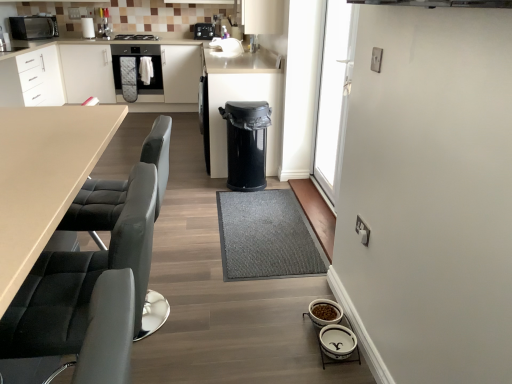
What do you see at coordinates (88, 27) in the screenshot? Image resolution: width=512 pixels, height=384 pixels. I see `white paper towel at upper left, the first appliance in the left-to-right sequence` at bounding box center [88, 27].

From the picture: What is the approximate width of gray textured mat at center?

gray textured mat at center is 23.94 inches wide.

At what (x,y) coordinates should I click in order to perform the action: click on matte black microwave at upper left. Please return your answer as a coordinate pair (x, y). This screenshot has width=512, height=384. Looking at the image, I should click on (33, 27).

What do you see at coordinates (33, 27) in the screenshot? The image size is (512, 384). I see `matte black microwave at upper left` at bounding box center [33, 27].

What is the approximate width of matte white cabinetry at left?

It is 8.17 feet.

This screenshot has height=384, width=512. In order to click on transparent glass door at upper right in this screenshot , I will do click(x=334, y=94).

Measure the distance between transparent glass door at upper right and camera.

transparent glass door at upper right is 2.16 meters from camera.

Identify the location of white paper towel at upper left, the second appliance positioned from the back. (88, 27).

Where is `dish washer that is behind the transparent glass door at upper right`? dish washer that is behind the transparent glass door at upper right is located at coordinates (246, 143).

Between transparent glass door at upper right and black plastic trash can at center, which one has less height?

black plastic trash can at center.

Between point (340, 37) and point (260, 112), which one is positioned behind?

The point (260, 112) is farther.

Between transparent glass door at upper right and black plastic trash can at center, which one appears on the right side from the viewer's perspective?

From the viewer's perspective, transparent glass door at upper right appears more on the right side.

Is black plastic trash can at center spatially inside white paper towel at upper left, the first appliance in the left-to-right sequence, or outside of it?

black plastic trash can at center exists outside the volume of white paper towel at upper left, the first appliance in the left-to-right sequence.

Based on the photo, considering the relative sizes of black plastic trash can at center and white paper towel at upper left, arranged as the second appliance when viewed from the top, in the image provided, is black plastic trash can at center thinner than white paper towel at upper left, arranged as the second appliance when viewed from the top,?

No, black plastic trash can at center is not thinner than white paper towel at upper left, arranged as the second appliance when viewed from the top.

Considering the sizes of black plastic trash can at center and white paper towel at upper left, the second appliance positioned from the back, in the image, is black plastic trash can at center bigger or smaller than white paper towel at upper left, the second appliance positioned from the back,?

Considering their sizes, black plastic trash can at center takes up more space than white paper towel at upper left, the second appliance positioned from the back.

Is the surface of black plastic trash can at center in direct contact with white paper towel at upper left, the second appliance positioned from the back?

No, black plastic trash can at center is not beside white paper towel at upper left, the second appliance positioned from the back.

Is black plastic toaster at upper center, the 3th appliance when ordered from front to back, located outside matte black microwave at upper left?

Yes, black plastic toaster at upper center, the 3th appliance when ordered from front to back, is located beyond the bounds of matte black microwave at upper left.

In the image, is black plastic toaster at upper center, the 1th appliance positioned from the top, on the left side or the right side of matte black microwave at upper left?

black plastic toaster at upper center, the 1th appliance positioned from the top, is to the right of matte black microwave at upper left.

From the image's perspective, between black plastic toaster at upper center, the 2th appliance in the right-to-left sequence, and matte black microwave at upper left, which one is located above?

black plastic toaster at upper center, the 2th appliance in the right-to-left sequence.

Who is smaller, black plastic toaster at upper center, the first appliance positioned from the back, or matte black microwave at upper left?

black plastic toaster at upper center, the first appliance positioned from the back.

Is white paper towel at upper left, the first appliance in the left-to-right sequence, next to black leather swivel chair at left and touching it?

No, white paper towel at upper left, the first appliance in the left-to-right sequence, is not in contact with black leather swivel chair at left.

Based on the photo, is white paper towel at upper left, the second appliance positioned from the back, taller than black leather swivel chair at left?

No.

From a real-world perspective, does white paper towel at upper left, placed as the second appliance when sorted from bottom to top, stand above black leather swivel chair at left?

Indeed, from a real-world perspective, white paper towel at upper left, placed as the second appliance when sorted from bottom to top, stands above black leather swivel chair at left.

How much distance is there between white paper towel at upper left, acting as the 2th appliance starting from the front, and black leather swivel chair at left?

They are 4.78 meters apart.

Which object is positioned more to the right, gray textured mat at center or satin black oven at center?

gray textured mat at center.

Can you tell me how much gray textured mat at center and satin black oven at center differ in facing direction?

The facing directions of gray textured mat at center and satin black oven at center are 90.6 degrees apart.

Which object is thinner, gray textured mat at center or satin black oven at center?

With smaller width is gray textured mat at center.

Locate an element on the screen. Image resolution: width=512 pixels, height=384 pixels. oven that is on the left side of gray textured mat at center is located at coordinates (x=137, y=71).

Does matte white cabinetry at left have a greater width compared to transparent glass door at upper right?

Yes.

Looking at this image, considering the positions of objects matte white cabinetry at left and transparent glass door at upper right in the image provided, who is more to the left, matte white cabinetry at left or transparent glass door at upper right?

Positioned to the left is matte white cabinetry at left.

Is matte black microwave at upper left thinner than black plastic toaster at upper center, the 3th appliance when ordered from front to back?

No.

How many degrees apart are the facing directions of matte black microwave at upper left and black plastic toaster at upper center, the first appliance positioned from the back?

49.7 degrees separate the facing orientations of matte black microwave at upper left and black plastic toaster at upper center, the first appliance positioned from the back.

Is matte black microwave at upper left closer to the viewer compared to black plastic toaster at upper center, the first appliance positioned from the back?

Yes, matte black microwave at upper left is closer to the camera.

Considering the positions of objects matte black microwave at upper left and black plastic toaster at upper center, marked as the 2th appliance in a left-to-right arrangement, in the image provided, who is more to the left, matte black microwave at upper left or black plastic toaster at upper center, marked as the 2th appliance in a left-to-right arrangement,?

From the viewer's perspective, matte black microwave at upper left appears more on the left side.

Identify the location of dish washer below the transparent glass door at upper right (from the image's perspective). Image resolution: width=512 pixels, height=384 pixels. (246, 143).

I want to click on dish washer below the white paper towel at upper left, arranged as the second appliance when viewed from the top (from a real-world perspective), so click(246, 143).

Based on their spatial positions, is black leather chair at left or black leather swivel chair at left further from black plastic toaster at upper center, marked as the 2th appliance in a left-to-right arrangement?

black leather chair at left is further to black plastic toaster at upper center, marked as the 2th appliance in a left-to-right arrangement.

From the image, which object appears to be nearer to black leather swivel chair at left, transparent glass door at upper right or gray textured mat at center?

gray textured mat at center is closer to black leather swivel chair at left.

When comparing their distances from matte white cabinetry at left, does black plastic toaster at upper center, marked as the 2th appliance in a left-to-right arrangement, or satin black oven at center seem closer?

The object closer to matte white cabinetry at left is satin black oven at center.

From the image, which object appears to be nearer to black plastic trash can at center, gray textured mat at center or matte black microwave at upper left?

gray textured mat at center is positioned closer to the anchor black plastic trash can at center.

In the scene shown: Looking at the image, which one is located closer to black leather chair at left, satin black oven at center or black leather swivel chair at left?

black leather swivel chair at left lies closer to black leather chair at left than the other object.

Looking at the image, which one is located closer to white glossy pet bowls at lower right, which appears as the 3th appliance when viewed from the left, black plastic toaster at upper center, the 1th appliance positioned from the top, or black leather chair at left?

black leather chair at left.

Consider the image. Looking at the image, which one is located closer to black leather chair at left, matte black microwave at upper left or transparent glass door at upper right?

transparent glass door at upper right is positioned closer to the anchor black leather chair at left.

Based on their spatial positions, is black plastic toaster at upper center, the 2th appliance in the right-to-left sequence, or transparent glass door at upper right further from matte white cabinetry at left?

transparent glass door at upper right is positioned further to the anchor matte white cabinetry at left.

Where is `cabinetry located between transparent glass door at upper right and white paper towel at upper left, the second appliance positioned from the back, in the depth direction`? cabinetry located between transparent glass door at upper right and white paper towel at upper left, the second appliance positioned from the back, in the depth direction is located at coordinates (57, 74).

Find the location of a particular element. dish washer located between black leather chair at left and white paper towel at upper left, the second appliance positioned from the back, in the depth direction is located at coordinates (246, 143).

Locate an element on the screen. This screenshot has width=512, height=384. home appliance between white glossy pet bowls at lower right, which appears as the 3th appliance when viewed from the left, and white paper towel at upper left, the first appliance in the left-to-right sequence, from front to back is located at coordinates (33, 27).

At what (x,y) coordinates should I click in order to perform the action: click on oven between black leather chair at left and black plastic toaster at upper center, arranged as the third appliance when ordered from the bottom, from front to back. Please return your answer as a coordinate pair (x, y). Looking at the image, I should click on (137, 71).